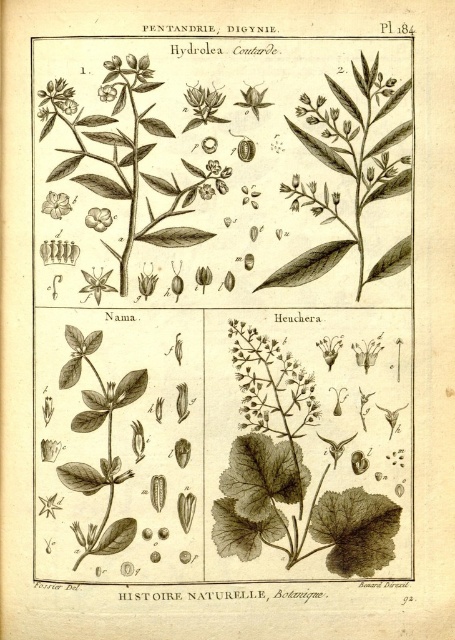
Is black ink plant at upper center closer to the viewer compared to smooth green leaf at upper center?

Yes.

Does black ink plant at upper center appear over smooth green leaf at upper center?

No, black ink plant at upper center is not above smooth green leaf at upper center.

Which is behind, point (247, 76) or point (196, 115)?

Positioned behind is point (196, 115).

Identify the location of black ink plant at upper center. This screenshot has width=455, height=640. point(223,310).

Does smooth green leaf at upper center have a larger size compared to matte yellow flower at upper left?

Yes, smooth green leaf at upper center is bigger than matte yellow flower at upper left.

Does smooth green leaf at upper center appear on the right side of matte yellow flower at upper left?

Correct, you'll find smooth green leaf at upper center to the right of matte yellow flower at upper left.

Find the location of `smooth green leaf at upper center`. smooth green leaf at upper center is located at coordinates (202, 106).

Who is shorter, matte yellow flower at upper left or smooth white flower at upper left?

Standing shorter between the two is smooth white flower at upper left.

Is point (51, 208) positioned after point (106, 92)?

Yes, it is.

Locate an element on the screen. The image size is (455, 640). matte yellow flower at upper left is located at coordinates (55, 204).